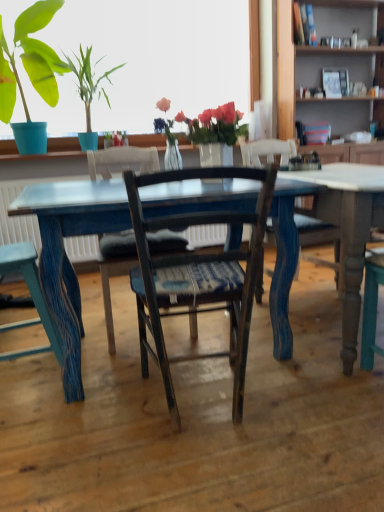
Question: Does distressed blue wood chair at lower left, the third chair from the right, appear on the left side of wooden bookshelf at upper right?

Choices:
 (A) no
 (B) yes

Answer: (B)

Question: Is distressed blue wood chair at lower left, which appears as the 1th chair when viewed from the left, positioned beyond the bounds of wooden bookshelf at upper right?

Choices:
 (A) no
 (B) yes

Answer: (B)

Question: From the image's perspective, is distressed blue wood chair at lower left, which appears as the 1th chair when viewed from the left, above wooden bookshelf at upper right?

Choices:
 (A) no
 (B) yes

Answer: (A)

Question: From a real-world perspective, does distressed blue wood chair at lower left, which appears as the 1th chair when viewed from the left, stand above wooden bookshelf at upper right?

Choices:
 (A) yes
 (B) no

Answer: (B)

Question: From the image's perspective, is distressed blue wood chair at lower left, the third chair from the right, below wooden bookshelf at upper right?

Choices:
 (A) no
 (B) yes

Answer: (B)

Question: In terms of width, does wooden chair with woven seat cushion at center, positioned as the 1th chair in right-to-left order, look wider or thinner when compared to matte blue pot at upper left?

Choices:
 (A) wide
 (B) thin

Answer: (A)

Question: Based on their sizes in the image, would you say wooden chair with woven seat cushion at center, positioned as the 1th chair in right-to-left order, is bigger or smaller than matte blue pot at upper left?

Choices:
 (A) big
 (B) small

Answer: (B)

Question: Relative to matte blue pot at upper left, is wooden chair with woven seat cushion at center, arranged as the third chair when viewed from the left, in front or behind?

Choices:
 (A) behind
 (B) front

Answer: (B)

Question: Does point (233, 216) appear closer or farther from the camera than point (54, 96)?

Choices:
 (A) farther
 (B) closer

Answer: (B)

Question: From the image's perspective, is wooden chair at center, which ranks as the second chair in right-to-left order, positioned above or below blue painted wood table at center?

Choices:
 (A) below
 (B) above

Answer: (B)

Question: Do you think wooden chair at center, which ranks as the second chair in right-to-left order, is within blue painted wood table at center, or outside of it?

Choices:
 (A) inside
 (B) outside

Answer: (B)

Question: Considering the relative positions of wooden chair at center, which ranks as the second chair in right-to-left order, and blue painted wood table at center in the image provided, is wooden chair at center, which ranks as the second chair in right-to-left order, to the left or to the right of blue painted wood table at center?

Choices:
 (A) right
 (B) left

Answer: (B)

Question: Is wooden chair at center, positioned as the 2th chair in left-to-right order, bigger or smaller than blue painted wood table at center?

Choices:
 (A) small
 (B) big

Answer: (A)

Question: Based on their sizes in the image, would you say translucent glass vase at upper center is bigger or smaller than blue painted wood table at center?

Choices:
 (A) big
 (B) small

Answer: (B)

Question: In terms of width, does translucent glass vase at upper center look wider or thinner when compared to blue painted wood table at center?

Choices:
 (A) wide
 (B) thin

Answer: (B)